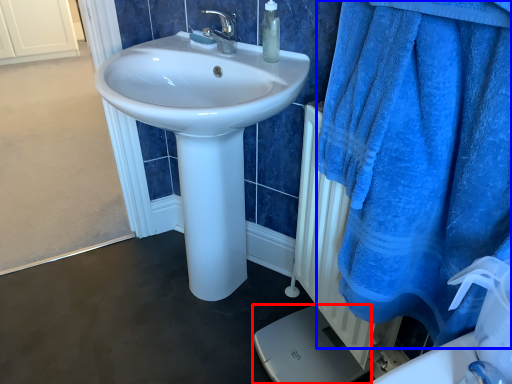
Question: Which point is further to the camera, porcelain (highlighted by a red box) or bath towel (highlighted by a blue box)?

Choices:
 (A) porcelain
 (B) bath towel

Answer: (A)